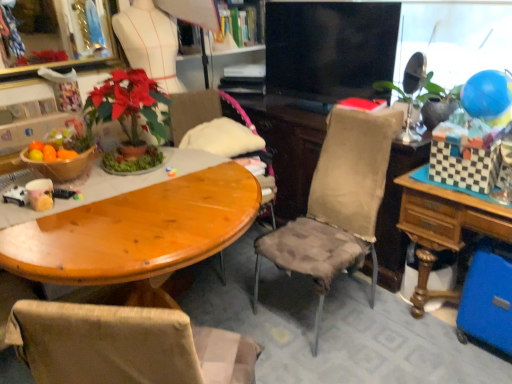
Question: From the image's perspective, is wooden chair at center, the 2th chair from the front, located above or below wooden table at right?

Choices:
 (A) below
 (B) above

Answer: (B)

Question: From a real-world perspective, relative to wooden table at right, is wooden chair at center, the first chair positioned from the back, vertically above or below?

Choices:
 (A) above
 (B) below

Answer: (A)

Question: Estimate the real-world distances between objects in this image. Which object is farther from the blue rubber balloon at upper right?

Choices:
 (A) textured beige chair at center, the 1th chair in the front-to-back sequence
 (B) wooden table at center
 (C) black glossy tv at center
 (D) wooden table at right
 (E) wooden chair at center, the first chair positioned from the back

Answer: (B)

Question: Estimate the real-world distances between objects in this image. Which object is closer to the wooden chair at center, the 2th chair from the front?

Choices:
 (A) wooden table at right
 (B) blue rubber balloon at upper right
 (C) textured beige chair at center, the second chair positioned from the back
 (D) black glossy tv at center
 (E) wooden table at center

Answer: (D)